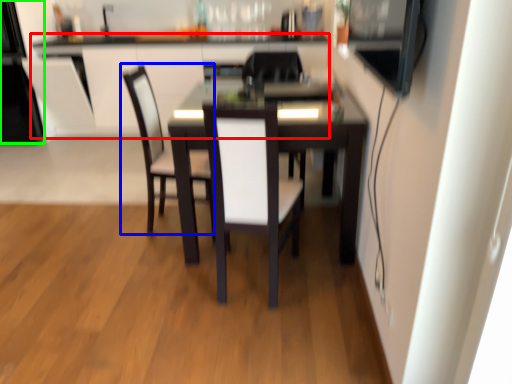
Question: Estimate the real-world distances between objects in this image. Which object is farther from computer desk (highlighted by a red box), chair (highlighted by a blue box) or appliance (highlighted by a green box)?

Choices:
 (A) chair
 (B) appliance

Answer: (A)